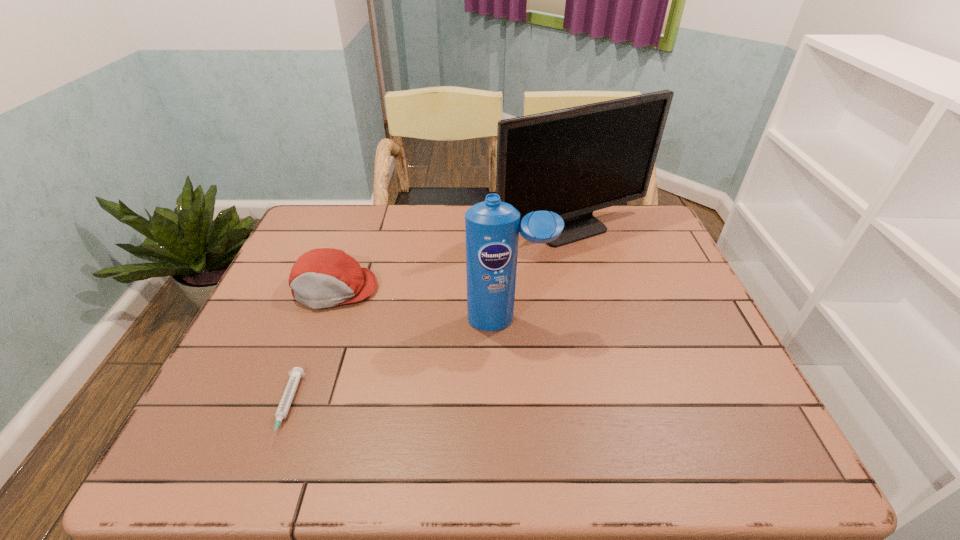
This screenshot has height=540, width=960. Find the location of `cap that is positioned at the left edge`. cap that is positioned at the left edge is located at coordinates (324, 277).

This screenshot has height=540, width=960. In order to click on syringe that is at the left edge in this screenshot , I will do 297,372.

I want to click on object located in the right edge section of the desktop, so click(x=573, y=161).

Find the location of `object that is at the near left corner`. object that is at the near left corner is located at coordinates (297, 372).

Locate an element on the screen. The width and height of the screenshot is (960, 540). object that is positioned at the far right corner is located at coordinates (573, 161).

Locate an element on the screen. Image resolution: width=960 pixels, height=540 pixels. vacant space at the far edge is located at coordinates (463, 245).

Locate an element on the screen. This screenshot has width=960, height=540. free space at the near edge of the desktop is located at coordinates (367, 460).

In the image, there is a desktop. Identify the location of free space at the left edge. (276, 343).

Find the location of a particular element. This screenshot has height=540, width=960. vacant area at the far left corner of the desktop is located at coordinates (311, 207).

Where is `free space at the far right corner`? free space at the far right corner is located at coordinates (617, 235).